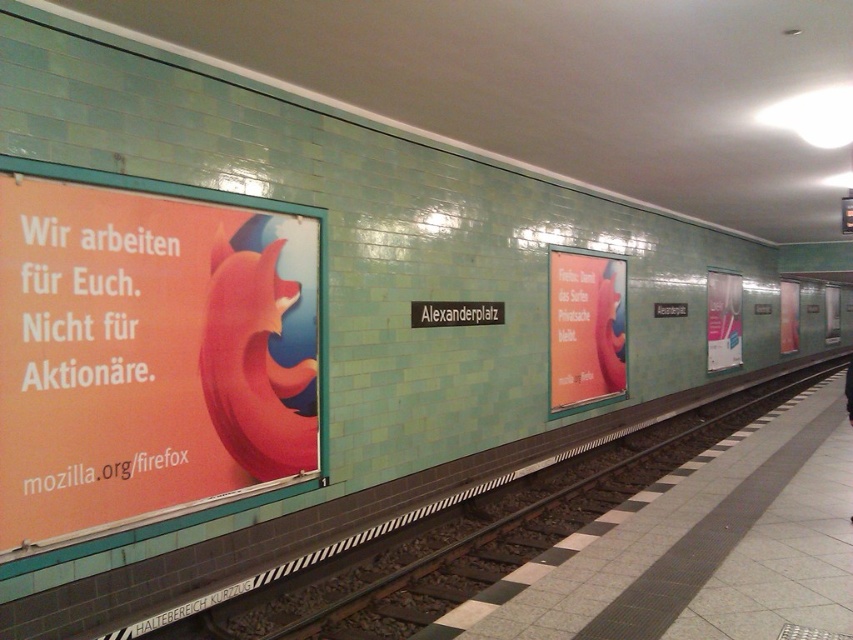
Does matte pink poster at center come behind smooth concrete platform at center?

Yes, it is.

Is matte pink poster at center wider than smooth concrete platform at center?

In fact, matte pink poster at center might be narrower than smooth concrete platform at center.

Which is behind, point (621, 365) or point (613, 525)?

Point (621, 365)

In order to click on matte pink poster at center in this screenshot , I will do `click(585, 326)`.

Based on the photo, can you confirm if matte pink poster at center is smaller than white glossy poster at right?

Correct, matte pink poster at center occupies less space than white glossy poster at right.

Does matte pink poster at center have a lesser width compared to white glossy poster at right?

Indeed, matte pink poster at center has a lesser width compared to white glossy poster at right.

Does point (570, 330) lie behind point (718, 333)?

No, (570, 330) is in front of (718, 333).

I want to click on matte pink poster at center, so click(x=585, y=326).

Between smooth concrete platform at center and white glossy poster at right, which one is positioned higher?

white glossy poster at right

Does smooth concrete platform at center appear over white glossy poster at right?

Incorrect, smooth concrete platform at center is not positioned above white glossy poster at right.

Where is `smooth concrete platform at center`? The width and height of the screenshot is (853, 640). smooth concrete platform at center is located at coordinates (581, 538).

The width and height of the screenshot is (853, 640). I want to click on smooth concrete platform at center, so click(x=581, y=538).